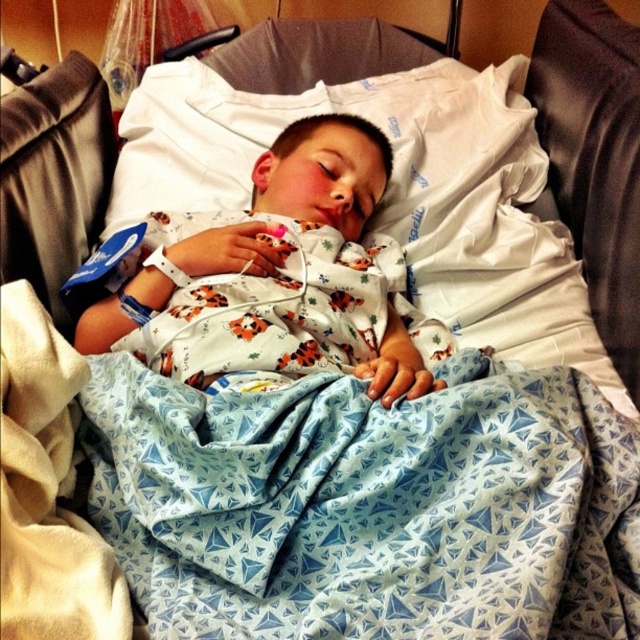
Is blue printed fabric at center to the right of white cotton pajamas at center from the viewer's perspective?

Correct, you'll find blue printed fabric at center to the right of white cotton pajamas at center.

Is blue printed fabric at center closer to camera compared to white cotton pajamas at center?

Yes, it is in front of white cotton pajamas at center.

Who is more forward, (282, 541) or (260, 244)?

Point (282, 541) is more forward.

Locate an element on the screen. blue printed fabric at center is located at coordinates (368, 506).